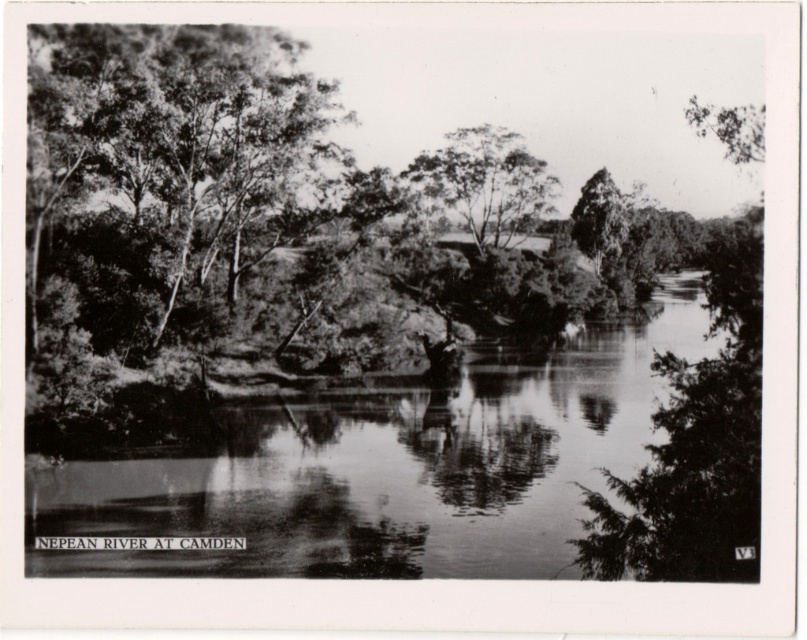
Question: Is smooth water at center positioned behind smooth bark tree at center?

Choices:
 (A) yes
 (B) no

Answer: (B)

Question: Does smooth water at center appear under smooth bark tree at center?

Choices:
 (A) no
 (B) yes

Answer: (B)

Question: Which object appears closest to the camera in this image?

Choices:
 (A) smooth bark tree at center
 (B) smooth water at center

Answer: (B)

Question: From the image, what is the correct spatial relationship of smooth water at center in relation to smooth bark tree at center?

Choices:
 (A) below
 (B) above

Answer: (A)

Question: Among these objects, which one is nearest to the camera?

Choices:
 (A) smooth water at center
 (B) smooth bark tree at center

Answer: (A)

Question: Among these objects, which one is nearest to the camera?

Choices:
 (A) smooth bark tree at center
 (B) smooth water at center

Answer: (B)